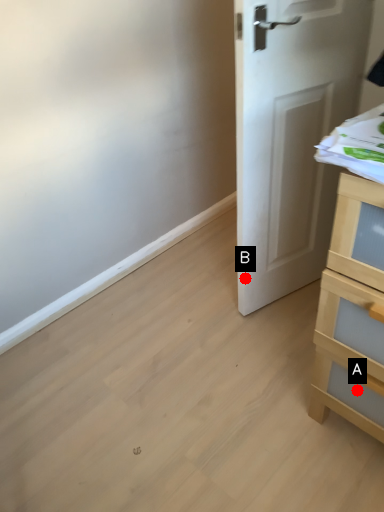
Question: Two points are circled on the image, labeled by A and B beside each circle. Which of the following is the farthest from the observer?

Choices:
 (A) A is further
 (B) B is further

Answer: (B)